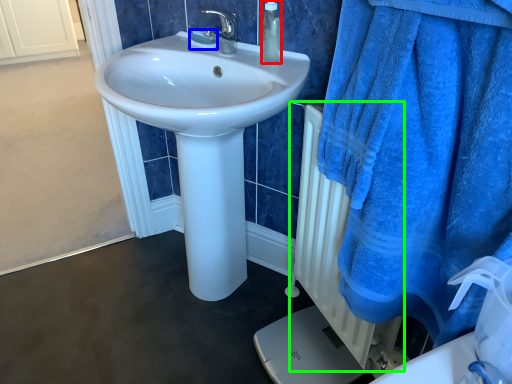
Question: Estimate the real-world distances between objects in this image. Which object is farther from soap dispenser (highlighted by a red box), soap (highlighted by a blue box) or radiator (highlighted by a green box)?

Choices:
 (A) soap
 (B) radiator

Answer: (B)